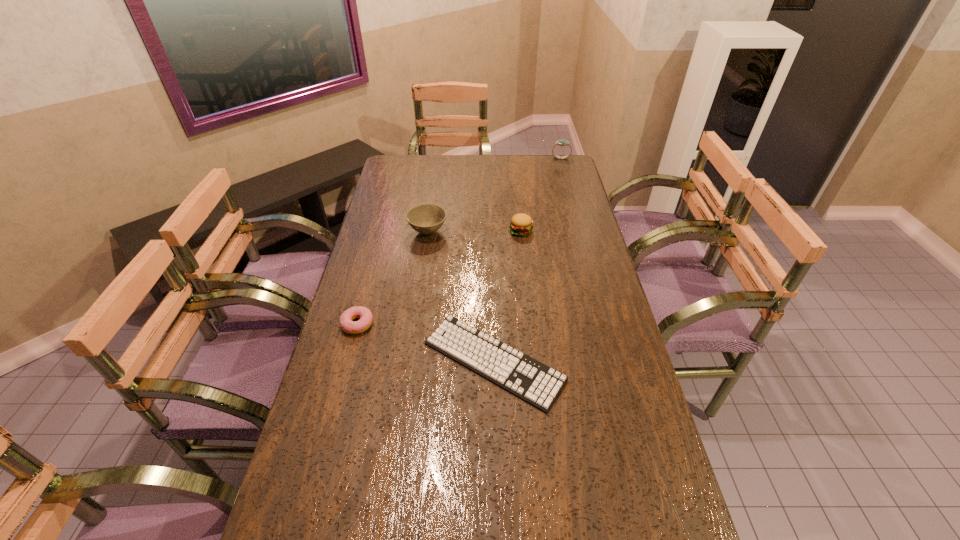
Identify the location of free space located 0.050m on the right of the second shortest object. (391, 325).

The height and width of the screenshot is (540, 960). In order to click on vacant space located on the left of the computer keyboard in this screenshot , I will do `click(353, 361)`.

In order to click on object at the far edge in this screenshot , I will do `click(561, 142)`.

This screenshot has width=960, height=540. Identify the location of bowl at the left edge. (427, 218).

Identify the location of doughnut at the left edge. click(x=366, y=318).

Identify the location of object that is at the right edge. (561, 142).

At what (x,y) coordinates should I click in order to perform the action: click on object that is at the far right corner. Please return your answer as a coordinate pair (x, y). This screenshot has height=540, width=960. Looking at the image, I should click on (561, 142).

Find the location of a particular element. This screenshot has height=540, width=960. vacant space at the far edge of the desktop is located at coordinates [x=531, y=181].

In the image, there is a desktop. Where is `vacant space at the left edge`? vacant space at the left edge is located at coordinates [x=354, y=285].

In the image, there is a desktop. Where is `vacant space at the right edge`? vacant space at the right edge is located at coordinates (580, 276).